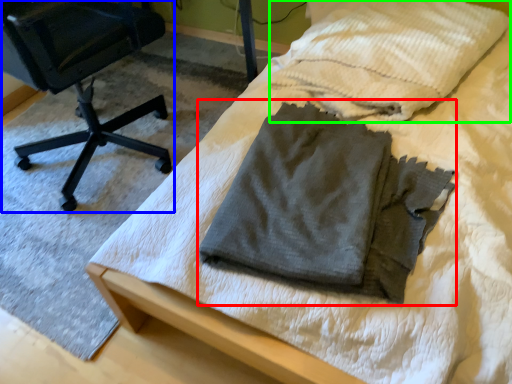
Question: Based on their relative distances, which object is farther from laundry (highlighted by a red box)? Choose from chair (highlighted by a blue box) and cloth (highlighted by a green box).

Choices:
 (A) chair
 (B) cloth

Answer: (A)